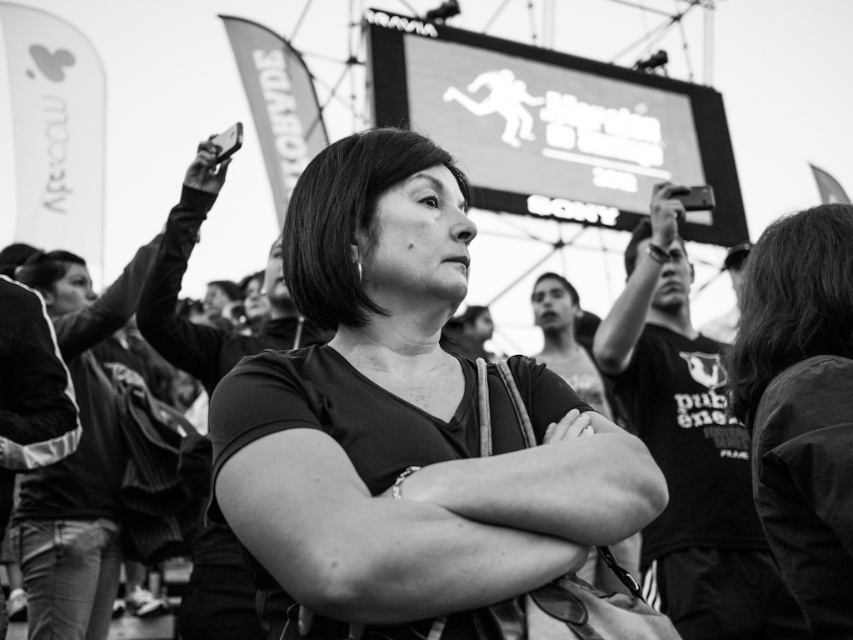
You are a photographer trying to capture the central woman in the scene. You have a metallic silver camera at upper center and a smooth black shirt at center in your viewfinder. Which object should you focus on to ensure the subject is clearly visible?

The smooth black shirt at center is bigger than the metallic silver camera at upper center, so focusing on the smooth black shirt at center would ensure the subject is clearly visible as it takes up more space in the frame.

You are attending an outdoor event and notice two items in the image. One is the smooth black jacket at center and the other is the metallic silver phone at upper left. Which item is positioned higher in the image?

The metallic silver phone at upper left is positioned higher than the smooth black jacket at center because the smooth black jacket at center is located below the metallic silver phone at upper left.

Based on the scene description and the objects provided, can you determine the exact 2D coordinates of the smooth black shirt at center?

The smooth black shirt at center is located at the 2D coordinates point (415, 435).